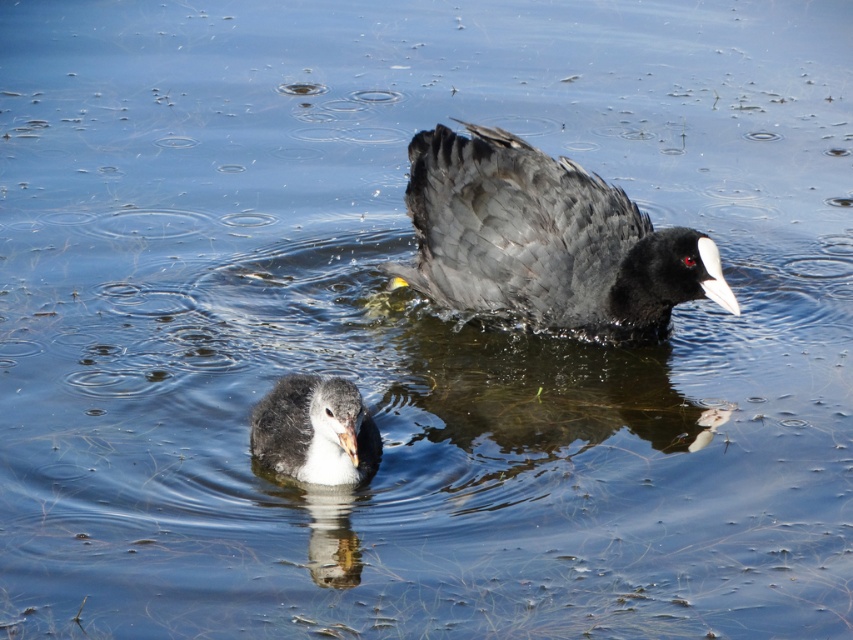
Looking at this image, you are a birdwatcher observing two ducks in the water. You notice the matte black duck at center and the gray downy duckling at center. Which duck is positioned to the left of the other?

The gray downy duckling at center is positioned to the left of the matte black duck at center.

You are observing two birds in the water. The larger bird has a white patch on its head and a white stripe from its beak to its eye, while the smaller bird has a lighter gray head and neck. Where is the matte black duck at center positioned in terms of coordinates?

The matte black duck at center is located at point (544, 241).

You are observing two points in the water. The first point is at coordinates point (416,168) and the second point is at point (306,394). From your perspective, which point is closer to you?

Point (306,394) is closer to you because point (416,168) is behind it.